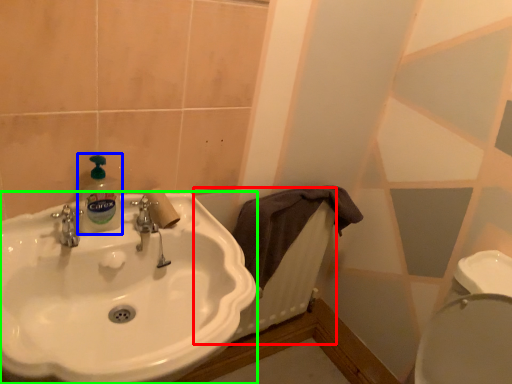
Question: Which is farther away from radiator (highlighted by a red box)? cleaning product (highlighted by a blue box) or sink (highlighted by a green box)?

Choices:
 (A) cleaning product
 (B) sink

Answer: (A)